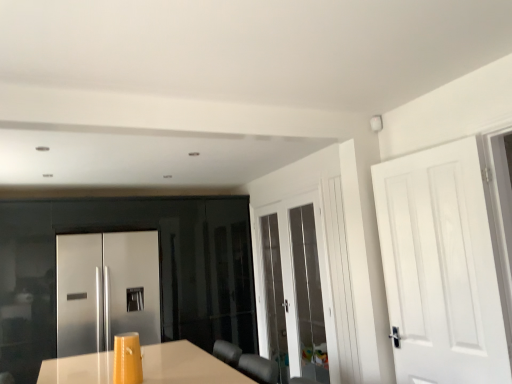
Find the location of a particular element. This screenshot has width=512, height=384. vacant space situated above white matte door at right, acting as the 1th door starting from the front (from a real-world perspective) is located at coordinates (428, 147).